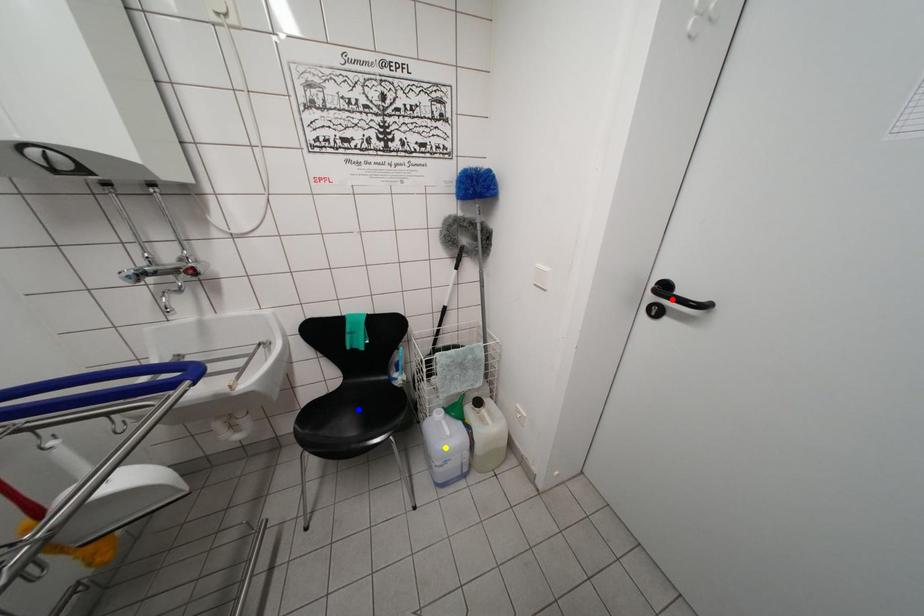
Order these from nearest to farthest:
yellow point, blue point, red point

red point → yellow point → blue point